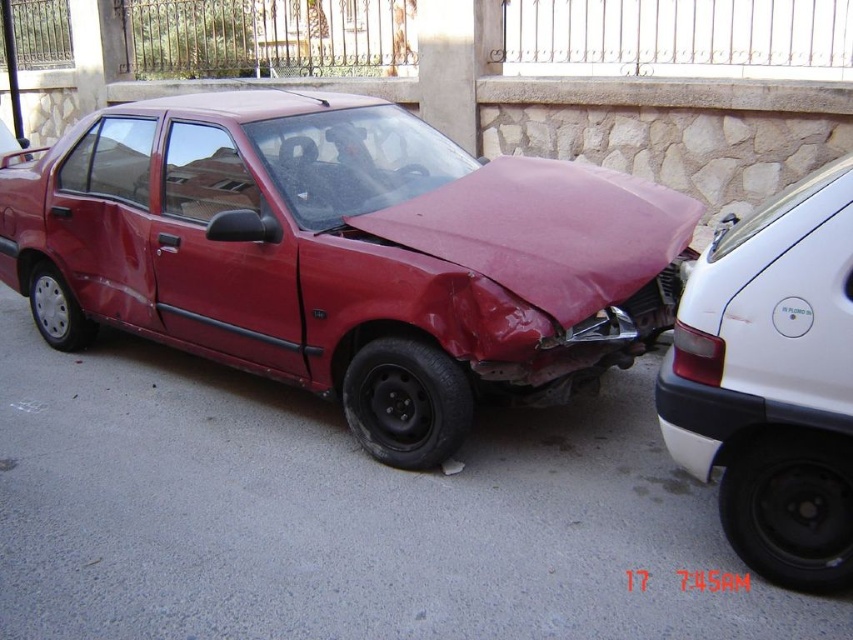
Question: Can you confirm if matte red car at center is bigger than white matte car at right?

Choices:
 (A) yes
 (B) no

Answer: (A)

Question: Which of the following is the farthest from the observer?

Choices:
 (A) (595, 336)
 (B) (842, 486)

Answer: (A)

Question: Does matte red car at center have a smaller size compared to white matte car at right?

Choices:
 (A) yes
 (B) no

Answer: (B)

Question: Which point is farther to the camera?

Choices:
 (A) matte red car at center
 (B) white matte car at right

Answer: (A)

Question: Does matte red car at center appear over white matte car at right?

Choices:
 (A) no
 (B) yes

Answer: (B)

Question: Which point is closer to the camera?

Choices:
 (A) (746, 506)
 (B) (167, 161)

Answer: (A)